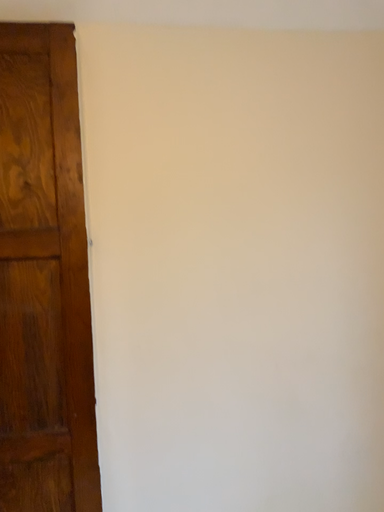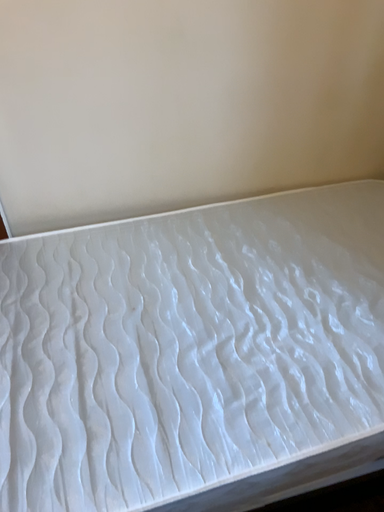
Question: Which way did the camera rotate in the video?

Choices:
 (A) rotated left
 (B) rotated right

Answer: (B)